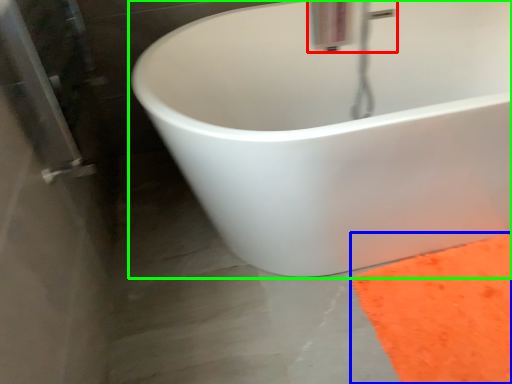
Question: Estimate the real-world distances between objects in this image. Which object is closer to plumbing fixture (highlighted by a red box), doormat (highlighted by a blue box) or bathtub (highlighted by a green box)?

Choices:
 (A) doormat
 (B) bathtub

Answer: (B)